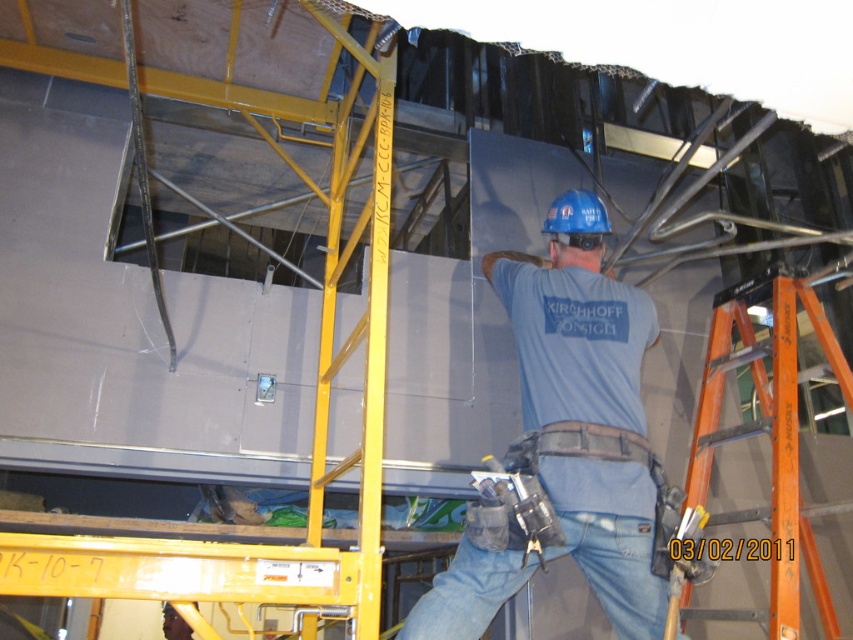
You are a safety inspector observing the construction site. You notice the blue hard hat at center and the orange fiberglass ladder at right. According to safety protocols, hard hats must be worn within 5 meters of a ladder. Are you compliant with this rule?

The blue hard hat at center is to the left of orange fiberglass ladder at right, so the distance between them is less than 5 meters. Therefore, the worker is compliant with the safety rule as the hard hat is worn within the required distance of the ladder.